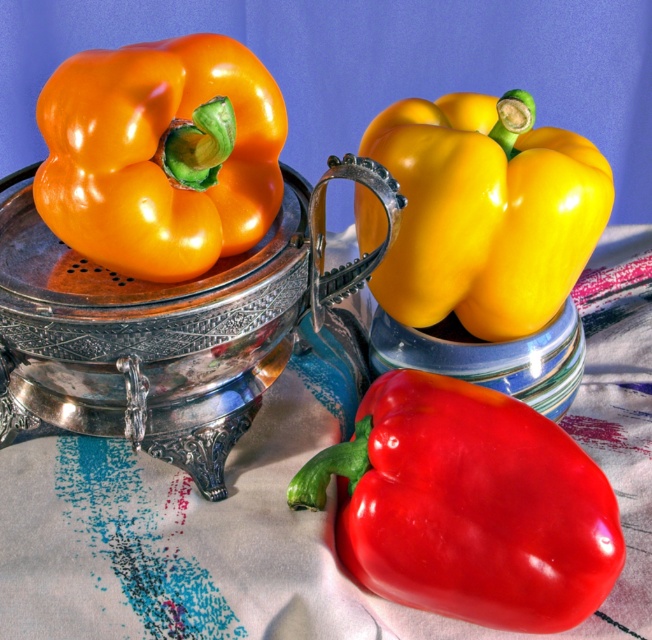
You are arranging a fruit display and need to know which bell pepper is wider. You see the glossy red bell pepper at lower center and the yellow glossy bell pepper at center. Which one has a greater width?

The glossy red bell pepper at lower center has a greater width than the yellow glossy bell pepper at center.

You are a chef preparing a dish that requires precise measurements. You have two bell peppers in front of you on the tablecloth, the glossy red bell pepper at lower center and the yellow glossy bell pepper at center. Which pepper should you choose if you need the larger one for your recipe?

The yellow glossy bell pepper at center is larger than the glossy red bell pepper at lower center, so you should choose the yellow glossy bell pepper at center for your recipe.

You are an artist setting up a still life. You have an orange glossy bell pepper at upper left and a yellow glossy bell pepper at center. Which pepper is positioned higher in the composition?

The orange glossy bell pepper at upper left is positioned higher than the yellow glossy bell pepper at center.